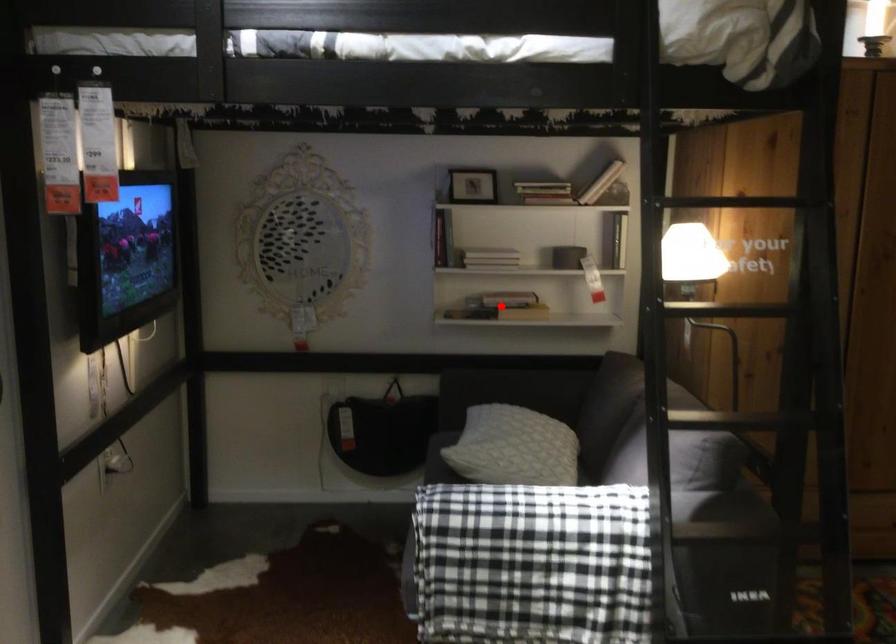
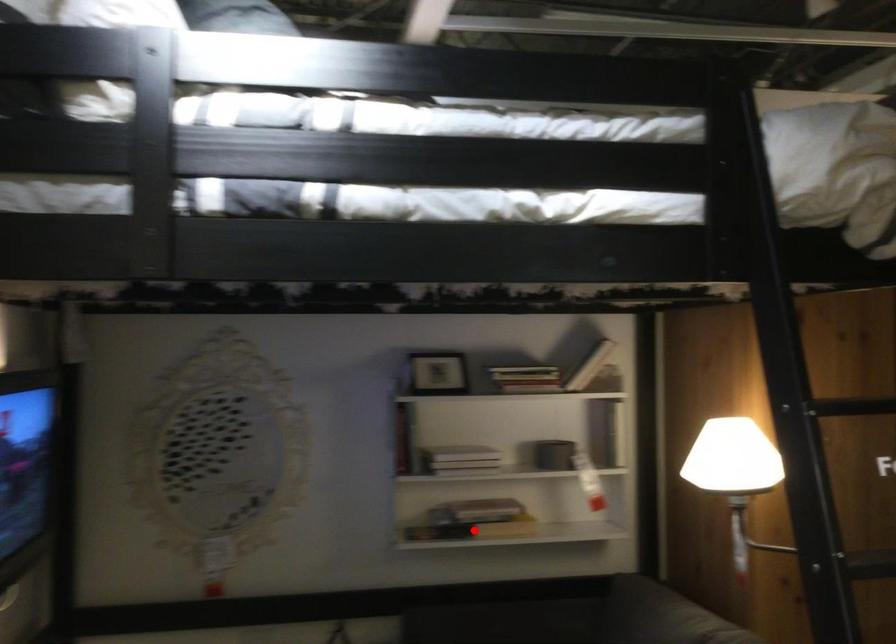
I am providing you with two images of the same scene from different viewpoints. A red point is marked on the first image and another point is marked on the second image. Do the highlighted points in image1 and image2 indicate the same real-world spot?

Yes